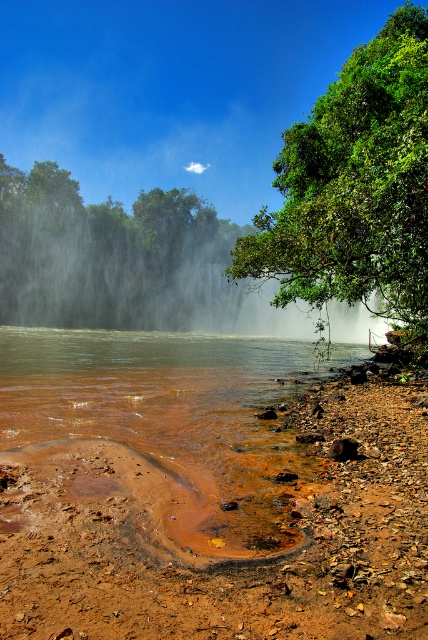
In the scene shown: Does white mist at center lie in front of green leafy tree at upper right?

That is False.

Is point (55, 113) closer to viewer compared to point (317, 106)?

No.

Locate an element on the screen. Image resolution: width=428 pixels, height=640 pixels. white mist at center is located at coordinates (148, 148).

Where is `white mist at center`? white mist at center is located at coordinates (148, 148).

Which of these two, white mist at center or brown muddy water at lower left, stands taller?

With more height is white mist at center.

How distant is white mist at center from brown muddy water at lower left?

They are 312.69 feet apart.

Identify the location of white mist at center. Image resolution: width=428 pixels, height=640 pixels. (148, 148).

Is brown muddy water at lower left above green leafy tree at upper right?

Actually, brown muddy water at lower left is below green leafy tree at upper right.

Is brown muddy water at lower left below green leafy tree at upper right?

Indeed, brown muddy water at lower left is positioned under green leafy tree at upper right.

Is point (214, 365) farther from camera compared to point (379, 209)?

Yes, point (214, 365) is behind point (379, 209).

Locate an element on the screen. This screenshot has height=640, width=428. brown muddy water at lower left is located at coordinates (172, 416).